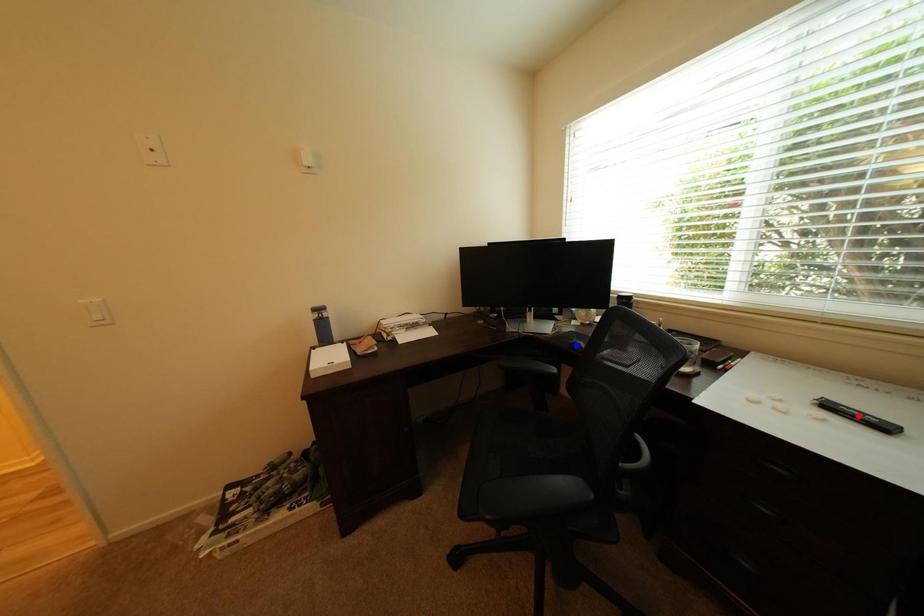
Question: Two points are marked on the image. Which point is closer to the camera?

Choices:
 (A) Blue point is closer.
 (B) Red point is closer.

Answer: (B)